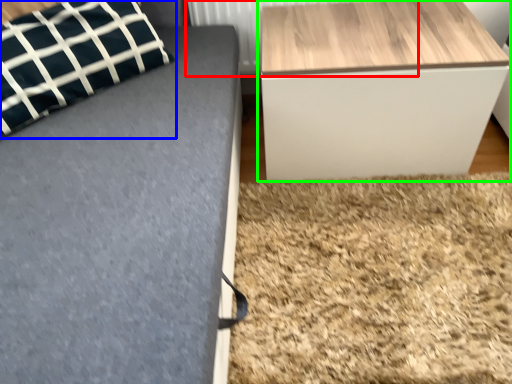
Question: Based on their relative distances, which object is farther from radiator (highlighted by a red box)? Choose from pillow (highlighted by a blue box) and table (highlighted by a green box).

Choices:
 (A) pillow
 (B) table

Answer: (A)